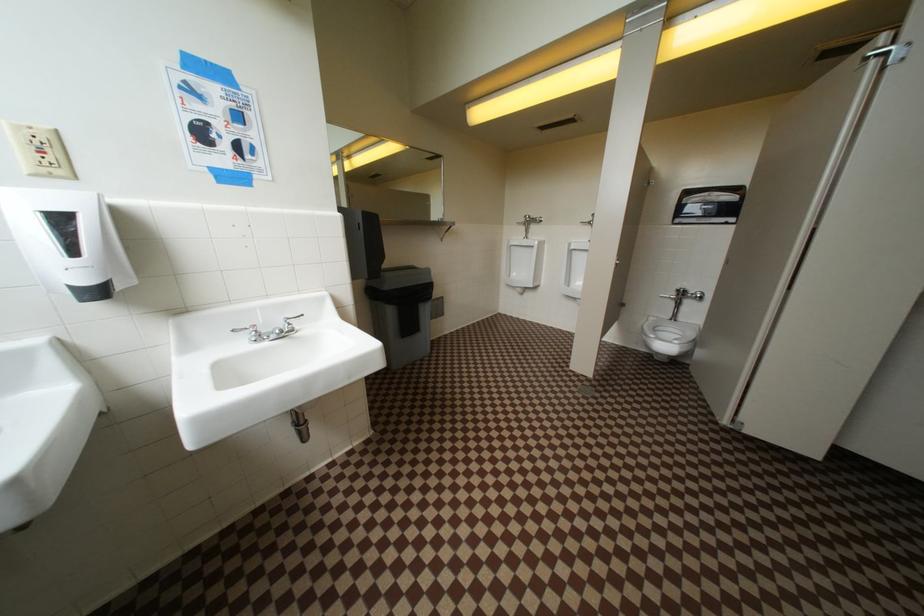
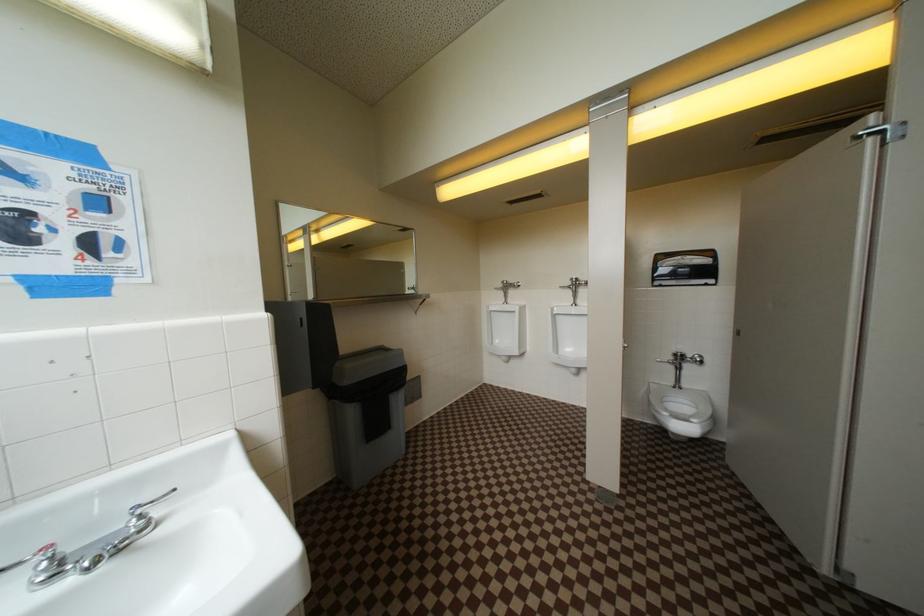
Question: In a continuous first-person perspective shot, in which direction is the camera moving?

Choices:
 (A) Left
 (B) Right
 (C) Forward
 (D) Backward

Answer: (C)